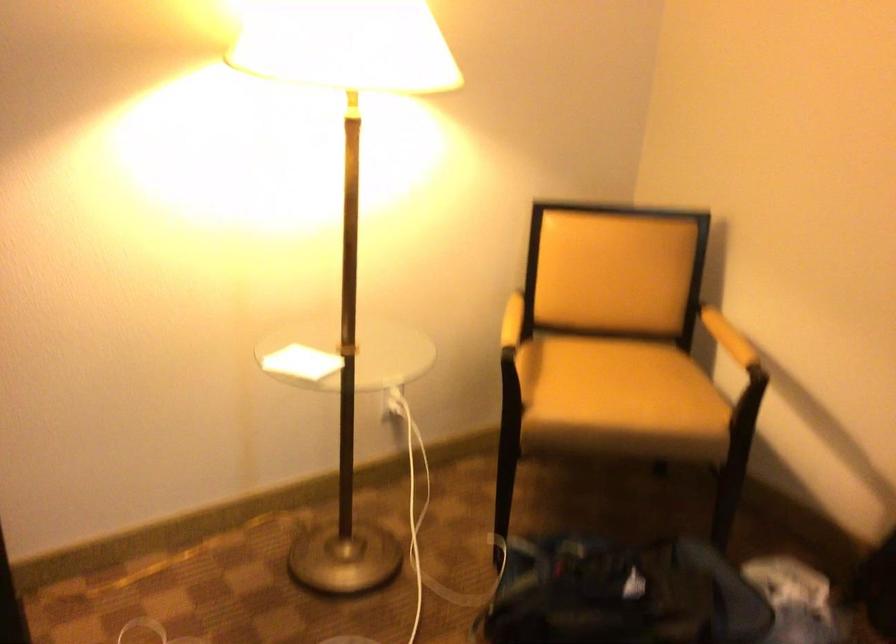
The image size is (896, 644). What do you see at coordinates (618, 388) in the screenshot?
I see `the yellow chair sitting surface` at bounding box center [618, 388].